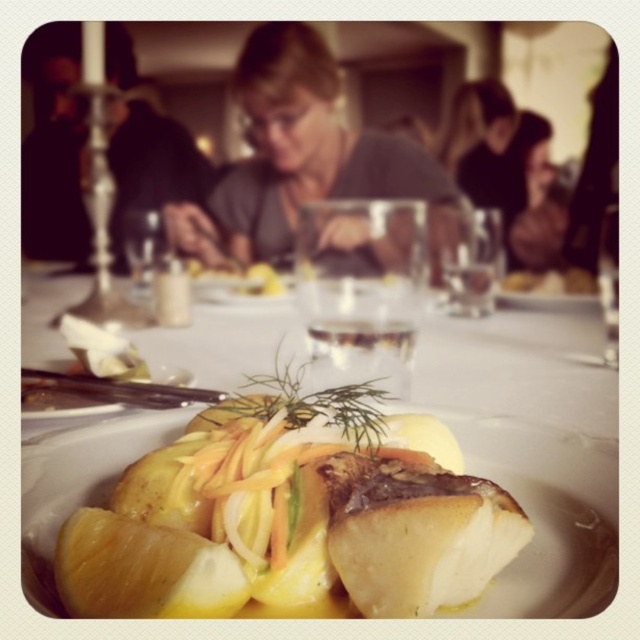
The image size is (640, 640). I want to click on white porcelain plate at center, so click(518, 369).

Who is more forward, [483,317] or [176,228]?

Point [483,317] is in front.

Does point (166, 332) lie in front of point (371, 147)?

Yes, point (166, 332) is closer to viewer.

Locate an element on the screen. The image size is (640, 640). white porcelain plate at center is located at coordinates (518, 369).

Which is below, gray matte shirt at center or matte gray sweater at upper center?

matte gray sweater at upper center is lower down.

You are a GUI agent. You are given a task and a screenshot of the screen. Output one action in this format:
    pyautogui.click(x=<x>, y=<y>)
    Task: Click on the gray matte shirt at center
    This screenshot has height=640, width=640.
    Given the screenshot: What is the action you would take?
    pyautogui.click(x=308, y=148)

Is point (257, 244) positioned after point (529, 115)?

Yes, point (257, 244) is behind point (529, 115).

You are a GUI agent. You are given a task and a screenshot of the screen. Output one action in this format:
    pyautogui.click(x=<x>, y=<y>)
    Task: Click on the gray matte shirt at center
    The width and height of the screenshot is (640, 640).
    Given the screenshot: What is the action you would take?
    pyautogui.click(x=308, y=148)

Consider the image. Who is lower down, golden glazed fish at center or gray matte shirt at center?

golden glazed fish at center is lower down.

Based on the photo, does golden glazed fish at center have a lesser height compared to gray matte shirt at center?

Indeed, golden glazed fish at center has a lesser height compared to gray matte shirt at center.

Who is more forward, (541, 445) or (244, 106)?

Point (541, 445) is more forward.

At what (x,y) coordinates should I click in order to perform the action: click on golden glazed fish at center. Please return your answer as a coordinate pair (x, y). Looking at the image, I should click on (556, 500).